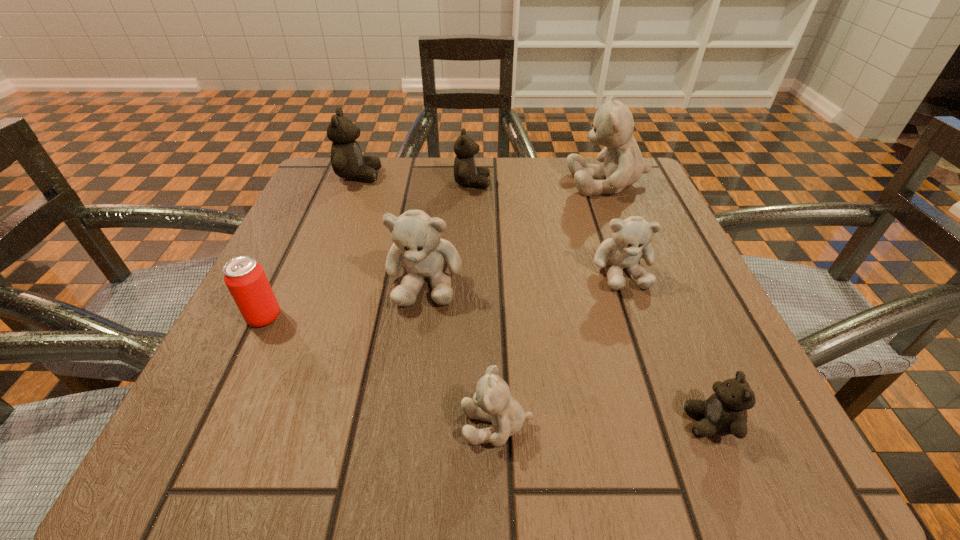
Point out which teddy bear is positioned as the second nearest to the third smallest gray teddy bear. Please provide its 2D coordinates. Your answer should be formatted as a tuple, i.e. [(x, y)], where the tuple contains the x and y coordinates of a point satisfying the conditions above.

[(466, 173)]

Select which gray teddy bear appears as the second closest to the smallest brown teddy bear. Please provide its 2D coordinates. Your answer should be formatted as a tuple, i.e. [(x, y)], where the tuple contains the x and y coordinates of a point satisfying the conditions above.

[(492, 402)]

Identify the location of the fourth closest gray teddy bear relative to the second brown teddy bear from right to left. Image resolution: width=960 pixels, height=540 pixels. click(492, 402).

Identify the location of brown teddy bear that is the third closest to the tallest object. (725, 412).

I want to click on the second closest brown teddy bear to the second biggest gray teddy bear, so click(347, 161).

Locate an element on the screen. This screenshot has width=960, height=540. blank space that satisfies the following two spatial constraints: 1. on the face of the second brown teddy bear from right to left; 2. on the face of the third smallest gray teddy bear is located at coordinates tap(469, 281).

Identify the location of vacant space that satisfies the following two spatial constraints: 1. on the face of the biggest brown teddy bear; 2. on the front side of the red beer can. The width and height of the screenshot is (960, 540). (304, 317).